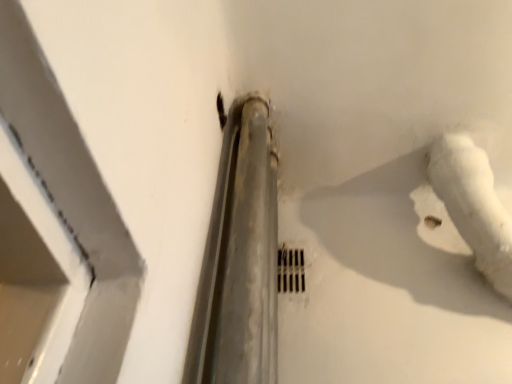
Identify the location of metallic grid at center. The image size is (512, 384). (290, 270).

The image size is (512, 384). What do you see at coordinates (290, 270) in the screenshot?
I see `metallic grid at center` at bounding box center [290, 270].

From the picture: Measure the distance between point (x=297, y=263) and camera.

Point (x=297, y=263) is 1.12 meters from camera.

Measure the distance between white matte water pipe at center-right and camera.

A distance of 90.15 centimeters exists between white matte water pipe at center-right and camera.

Describe the element at coordinates (474, 205) in the screenshot. This screenshot has height=384, width=512. I see `white matte water pipe at center-right` at that location.

What is the approximate width of white matte water pipe at center-right?

It is 9.72 inches.

At what (x,y) coordinates should I click in order to perform the action: click on white matte water pipe at center-right. Please return your answer as a coordinate pair (x, y). The height and width of the screenshot is (384, 512). Looking at the image, I should click on (474, 205).

At what (x,y) coordinates should I click in order to perform the action: click on metallic grid at center. Please return your answer as a coordinate pair (x, y). Image resolution: width=512 pixels, height=384 pixels. Looking at the image, I should click on (290, 270).

Which object is positioned more to the right, white matte water pipe at center-right or metallic grid at center?

Positioned to the right is white matte water pipe at center-right.

Is white matte water pipe at center-right closer to the viewer compared to metallic grid at center?

Yes, it is.

Which is nearer, (495,214) or (297,288)?

Clearly, point (495,214) is closer to the camera than point (297,288).

From the image's perspective, who appears lower, white matte water pipe at center-right or metallic grid at center?

metallic grid at center, from the image's perspective.

From a real-world perspective, relative to metallic grid at center, is white matte water pipe at center-right vertically above or below?

From a real-world perspective, white matte water pipe at center-right is physically above metallic grid at center.

Can you confirm if white matte water pipe at center-right is thinner than metallic grid at center?

No.

Can you confirm if white matte water pipe at center-right is shorter than metallic grid at center?

No.

Considering the relative sizes of white matte water pipe at center-right and metallic grid at center in the image provided, is white matte water pipe at center-right bigger than metallic grid at center?

Yes, white matte water pipe at center-right is bigger than metallic grid at center.

Choose the correct answer: Is white matte water pipe at center-right inside metallic grid at center or outside it?

white matte water pipe at center-right lies outside metallic grid at center.

Would you consider white matte water pipe at center-right to be distant from metallic grid at center?

white matte water pipe at center-right is near metallic grid at center, not far away.

Is white matte water pipe at center-right aimed at metallic grid at center?

No, white matte water pipe at center-right is not facing towards metallic grid at center.

How many degrees apart are the facing directions of white matte water pipe at center-right and metallic grid at center?

The facing directions of white matte water pipe at center-right and metallic grid at center are 0.0104 degrees apart.

The height and width of the screenshot is (384, 512). Find the location of `water pipe that appears on the right of metallic grid at center`. water pipe that appears on the right of metallic grid at center is located at coordinates point(474,205).

Is metallic grid at center to the left of white matte water pipe at center-right from the viewer's perspective?

Yes, metallic grid at center is to the left of white matte water pipe at center-right.

Considering their positions, is metallic grid at center located in front of or behind white matte water pipe at center-right?

metallic grid at center is behind white matte water pipe at center-right.

Does point (283, 289) come closer to viewer compared to point (433, 168)?

Yes, point (283, 289) is in front of point (433, 168).

From the image's perspective, is metallic grid at center located above white matte water pipe at center-right?

No, from the image's perspective, metallic grid at center is not over white matte water pipe at center-right.

From a real-world perspective, is metallic grid at center positioned above or below white matte water pipe at center-right?

In terms of real-world spatial position, metallic grid at center is below white matte water pipe at center-right.

Can you confirm if metallic grid at center is wider than white matte water pipe at center-right?

No.

In terms of height, does metallic grid at center look taller or shorter compared to white matte water pipe at center-right?

Clearly, metallic grid at center is shorter compared to white matte water pipe at center-right.

Who is smaller, metallic grid at center or white matte water pipe at center-right?

metallic grid at center is smaller.

Would you say metallic grid at center is outside white matte water pipe at center-right?

That's correct, metallic grid at center is outside of white matte water pipe at center-right.

Is metallic grid at center placed right next to white matte water pipe at center-right?

No, metallic grid at center is not with white matte water pipe at center-right.

Based on the photo, is metallic grid at center oriented towards white matte water pipe at center-right?

No, metallic grid at center is not aimed at white matte water pipe at center-right.

How many degrees apart are the facing directions of metallic grid at center and white matte water pipe at center-right?

There is a 0.0104-degree angle between the facing directions of metallic grid at center and white matte water pipe at center-right.

Locate an element on the screen. This screenshot has width=512, height=384. water pipe located in front of the metallic grid at center is located at coordinates (474, 205).

You are a GUI agent. You are given a task and a screenshot of the screen. Output one action in this format:
    pyautogui.click(x=<x>, y=<y>)
    Task: Click on the water pipe that is in front of the metallic grid at center
    The width and height of the screenshot is (512, 384).
    Given the screenshot: What is the action you would take?
    pyautogui.click(x=474, y=205)

Image resolution: width=512 pixels, height=384 pixels. What are the coordinates of `hole located below the white matte water pipe at center-right (from the image's perspective)` in the screenshot? It's located at (290, 270).